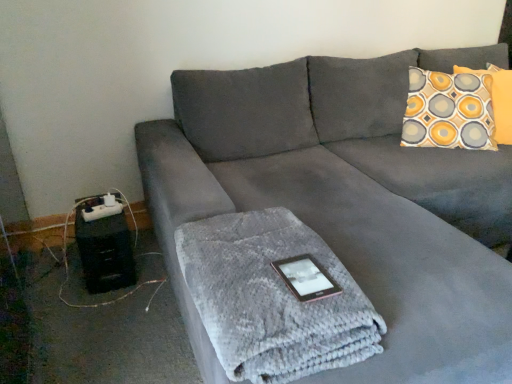
Where is `patterned fabric pillow at upper right`? This screenshot has width=512, height=384. patterned fabric pillow at upper right is located at coordinates (497, 99).

Measure the distance between gray fluffy bath towel at center and camera.

They are 85.32 centimeters apart.

Image resolution: width=512 pixels, height=384 pixels. What do you see at coordinates (306, 278) in the screenshot?
I see `pink glossy tablet at center` at bounding box center [306, 278].

Identify the location of patterned fabric pillow at upper right. The image size is (512, 384). (497, 99).

From a real-world perspective, is pink glossy tablet at center physically located above or below yellow and gray patterned pillow at upper right?

Clearly, from a real-world perspective, pink glossy tablet at center is below yellow and gray patterned pillow at upper right.

I want to click on throw pillow lying above the pink glossy tablet at center (from the image's perspective), so click(449, 111).

In the scene shown: Can you confirm if pink glossy tablet at center is positioned to the right of yellow and gray patterned pillow at upper right?

Incorrect, pink glossy tablet at center is not on the right side of yellow and gray patterned pillow at upper right.

What's the angular difference between suede gray couch at center and gray fluffy bath towel at center's facing directions?

They differ by 86.4 degrees in their facing directions.

Considering the relative sizes of suede gray couch at center and gray fluffy bath towel at center in the image provided, is suede gray couch at center wider than gray fluffy bath towel at center?

Yes.

Is suede gray couch at center at the right side of gray fluffy bath towel at center?

Indeed, suede gray couch at center is positioned on the right side of gray fluffy bath towel at center.

Locate an element on the screen. bath towel behind the suede gray couch at center is located at coordinates (x=274, y=297).

What's the angular difference between gray fluffy bath towel at center and yellow and gray patterned pillow at upper right's facing directions?

The angular difference between gray fluffy bath towel at center and yellow and gray patterned pillow at upper right is 124 degrees.

Looking at this image, does gray fluffy bath towel at center have a greater height compared to yellow and gray patterned pillow at upper right?

In fact, gray fluffy bath towel at center may be shorter than yellow and gray patterned pillow at upper right.

Is gray fluffy bath towel at center facing away from yellow and gray patterned pillow at upper right?

gray fluffy bath towel at center does not have its back to yellow and gray patterned pillow at upper right.

Between gray fluffy bath towel at center and yellow and gray patterned pillow at upper right, which one is positioned in front?

Positioned in front is gray fluffy bath towel at center.

Identify the location of pillow lying behind the pink glossy tablet at center. The width and height of the screenshot is (512, 384). (497, 99).

Does pink glossy tablet at center lie behind patterned fabric pillow at upper right?

No, it is in front of patterned fabric pillow at upper right.

Are pink glossy tablet at center and patterned fabric pillow at upper right located far from each other?

Yes, pink glossy tablet at center and patterned fabric pillow at upper right are quite far apart.

Which is nearer, (327, 285) or (506, 133)?

The point (327, 285) is more forward.

Considering the positions of objects patterned fabric pillow at upper right and yellow and gray patterned pillow at upper right in the image provided, who is in front, patterned fabric pillow at upper right or yellow and gray patterned pillow at upper right?

yellow and gray patterned pillow at upper right.

From the image's perspective, is patterned fabric pillow at upper right above or below yellow and gray patterned pillow at upper right?

Clearly, from the image's perspective, patterned fabric pillow at upper right is above yellow and gray patterned pillow at upper right.

Is patterned fabric pillow at upper right with yellow and gray patterned pillow at upper right?

No, patterned fabric pillow at upper right is not next to yellow and gray patterned pillow at upper right.

Who is smaller, patterned fabric pillow at upper right or yellow and gray patterned pillow at upper right?

Smaller between the two is patterned fabric pillow at upper right.

Is gray fluffy bath towel at center aimed at pink glossy tablet at center?

Yes, gray fluffy bath towel at center is oriented towards pink glossy tablet at center.

Is gray fluffy bath towel at center wider than pink glossy tablet at center?

Yes, gray fluffy bath towel at center is wider than pink glossy tablet at center.

From a real-world perspective, which is physically above, gray fluffy bath towel at center or pink glossy tablet at center?

In real-world perspective, pink glossy tablet at center is above.

Which is nearer, (304,237) or (305,273)?

Point (304,237).

Can you tell me how much yellow and gray patterned pillow at upper right and patterned fabric pillow at upper right differ in facing direction?

The facing directions of yellow and gray patterned pillow at upper right and patterned fabric pillow at upper right are 12.9 degrees apart.

From the picture: Which is behind, yellow and gray patterned pillow at upper right or patterned fabric pillow at upper right?

patterned fabric pillow at upper right.

Is yellow and gray patterned pillow at upper right taller or shorter than patterned fabric pillow at upper right?

Considering their sizes, yellow and gray patterned pillow at upper right has more height than patterned fabric pillow at upper right.

Could you tell me if yellow and gray patterned pillow at upper right is turned towards patterned fabric pillow at upper right?

Yes, yellow and gray patterned pillow at upper right faces towards patterned fabric pillow at upper right.

At what (x,y) coordinates should I click in order to perform the action: click on tablet computer that is on the left side of yellow and gray patterned pillow at upper right. Please return your answer as a coordinate pair (x, y). This screenshot has height=384, width=512. Looking at the image, I should click on (306, 278).

Where is `studio couch that appears below the gray fluffy bath towel at center (from a real-world perspective)`? studio couch that appears below the gray fluffy bath towel at center (from a real-world perspective) is located at coordinates (348, 201).

Which object lies nearer to the anchor point gray fluffy bath towel at center, patterned fabric pillow at upper right or yellow and gray patterned pillow at upper right?

Based on the image, yellow and gray patterned pillow at upper right appears to be nearer to gray fluffy bath towel at center.

From the picture: Which object lies nearer to the anchor point gray fluffy bath towel at center, yellow and gray patterned pillow at upper right or patterned fabric pillow at upper right?

The object closer to gray fluffy bath towel at center is yellow and gray patterned pillow at upper right.

When comparing their distances from yellow and gray patterned pillow at upper right, does patterned fabric pillow at upper right or pink glossy tablet at center seem closer?

patterned fabric pillow at upper right.

From the image, which object appears to be farther from gray fluffy bath towel at center, patterned fabric pillow at upper right or pink glossy tablet at center?

Among the two, patterned fabric pillow at upper right is located further to gray fluffy bath towel at center.

Looking at the image, which one is located closer to yellow and gray patterned pillow at upper right, pink glossy tablet at center or suede gray couch at center?

suede gray couch at center.

Based on their spatial positions, is gray fluffy bath towel at center or pink glossy tablet at center closer to patterned fabric pillow at upper right?

Based on the image, gray fluffy bath towel at center appears to be nearer to patterned fabric pillow at upper right.

Based on their spatial positions, is yellow and gray patterned pillow at upper right or pink glossy tablet at center further from suede gray couch at center?

The object further to suede gray couch at center is pink glossy tablet at center.

Looking at the image, which one is located closer to pink glossy tablet at center, yellow and gray patterned pillow at upper right or suede gray couch at center?

suede gray couch at center.

You are a GUI agent. You are given a task and a screenshot of the screen. Output one action in this format:
    pyautogui.click(x=<x>, y=<y>)
    Task: Click on the throw pillow between gray fluffy bath towel at center and patterned fabric pillow at upper right from left to right
    The image size is (512, 384).
    Given the screenshot: What is the action you would take?
    pyautogui.click(x=449, y=111)

You are a GUI agent. You are given a task and a screenshot of the screen. Output one action in this format:
    pyautogui.click(x=<x>, y=<y>)
    Task: Click on the throw pillow between pink glossy tablet at center and patterned fabric pillow at upper right from left to right
    This screenshot has width=512, height=384.
    Given the screenshot: What is the action you would take?
    pyautogui.click(x=449, y=111)

Find the location of `tablet computer located between gray fluffy bath towel at center and suede gray couch at center in the left-right direction`. tablet computer located between gray fluffy bath towel at center and suede gray couch at center in the left-right direction is located at coordinates (306, 278).

This screenshot has height=384, width=512. I want to click on bath towel between suede gray couch at center and yellow and gray patterned pillow at upper right along the z-axis, so click(274, 297).